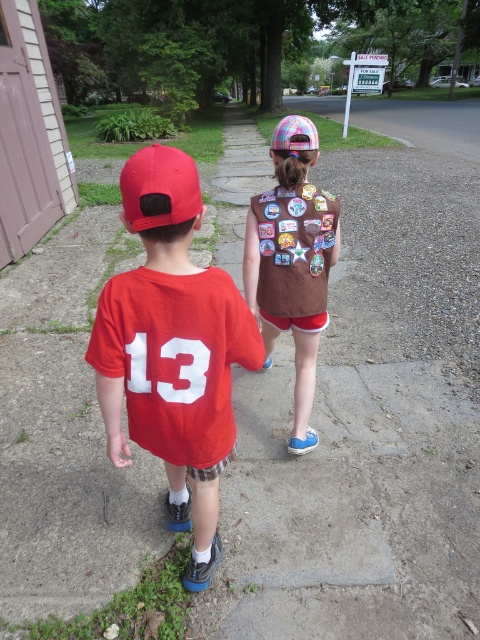
From the picture: You are standing at the camera position and want to walk towards the two points on the path. Which point would you reach first, point (124, 204) or point (106, 424)?

Point (124, 204) is closer to the camera than point (106, 424), so you would reach point (124, 204) first.